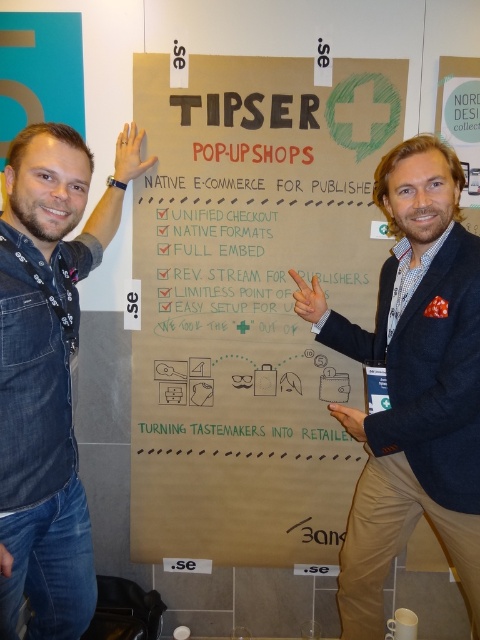
Question: Is blue denim shirt at left wider than matte black hand at upper left?

Choices:
 (A) yes
 (B) no

Answer: (A)

Question: Which point is farther to the camera?

Choices:
 (A) matte black hand at upper left
 (B) matte black hand at center
 (C) brown cardboard sign at center
 (D) blue denim shirt at left

Answer: (A)

Question: Estimate the real-world distances between objects in this image. Which object is farther from the matte black hand at lower left?

Choices:
 (A) matte white hand at center
 (B) blue denim shirt at left
 (C) blue denim jeans at center

Answer: (A)

Question: Can you confirm if brown cardboard sign at center is positioned to the right of matte white hand at center?

Choices:
 (A) yes
 (B) no

Answer: (B)

Question: Which of the following is the closest to the observer?

Choices:
 (A) blue denim jeans at center
 (B) matte white hand at center
 (C) matte black hand at lower left
 (D) matte black hand at upper left

Answer: (C)

Question: Is brown cardboard sign at center bigger than matte black hand at upper left?

Choices:
 (A) no
 (B) yes

Answer: (B)